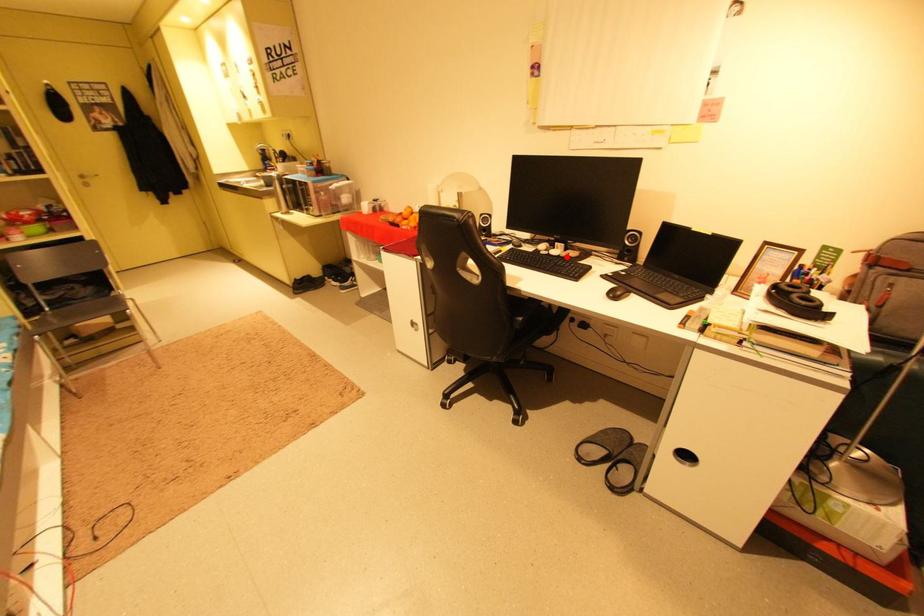
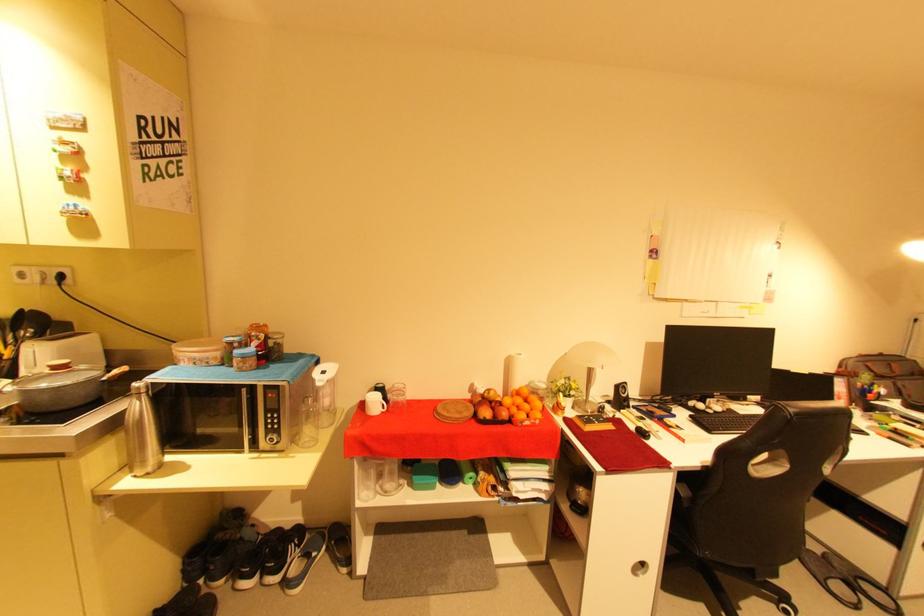
In the second image, find the point that corresponds to the highlighted location in the first image.

(730, 411)